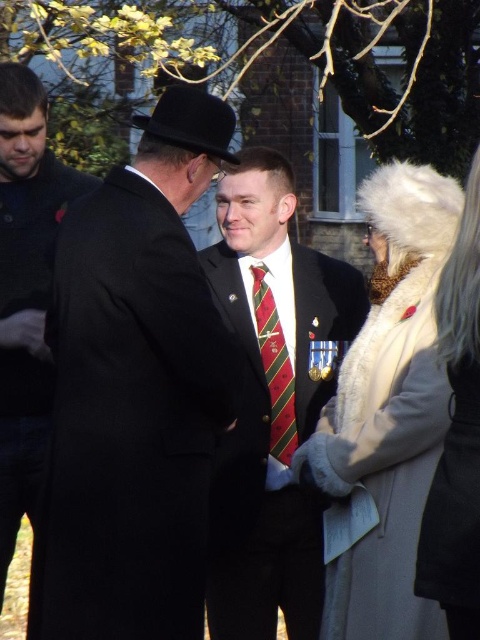
Question: Is matte black coat at left wider than white fur coat at right?

Choices:
 (A) no
 (B) yes

Answer: (B)

Question: Is matte black coat at left to the left of black felt fedora at center from the viewer's perspective?

Choices:
 (A) yes
 (B) no

Answer: (A)

Question: Estimate the real-world distances between objects in this image. Which object is closer to the matte black coat at left?

Choices:
 (A) shiny black suit at center
 (B) matte black coat at center
 (C) fur coat at center

Answer: (A)

Question: Which point is farther from the camera taking this photo?

Choices:
 (A) (21, 138)
 (B) (344, 632)

Answer: (A)

Question: Does matte black coat at center have a greater width compared to white fur coat at right?

Choices:
 (A) no
 (B) yes

Answer: (B)

Question: Which object is the closest to the shiny black suit at center?

Choices:
 (A) white fur coat at right
 (B) fur coat at center
 (C) matte black coat at center

Answer: (B)